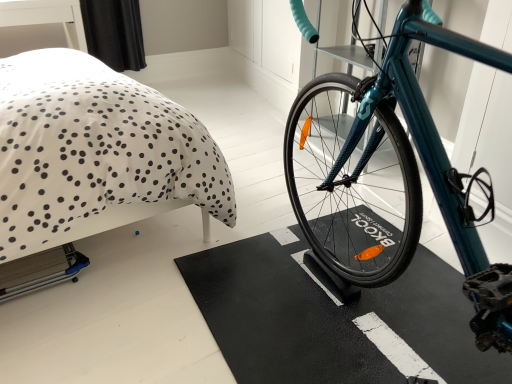
Question: Relative to teal glossy bicycle at center, is white dotted fabric at upper left in front or behind?

Choices:
 (A) behind
 (B) front

Answer: (A)

Question: From the image's perspective, relative to teal glossy bicycle at center, is white dotted fabric at upper left above or below?

Choices:
 (A) below
 (B) above

Answer: (B)

Question: Considering the real-world distances, which object is farthest from the teal glossy bicycle at center?

Choices:
 (A) black rubber bath mat at center
 (B) white dotted fabric at upper left

Answer: (B)

Question: Estimate the real-world distances between objects in this image. Which object is closer to the white dotted fabric at upper left?

Choices:
 (A) black rubber bath mat at center
 (B) teal glossy bicycle at center

Answer: (A)